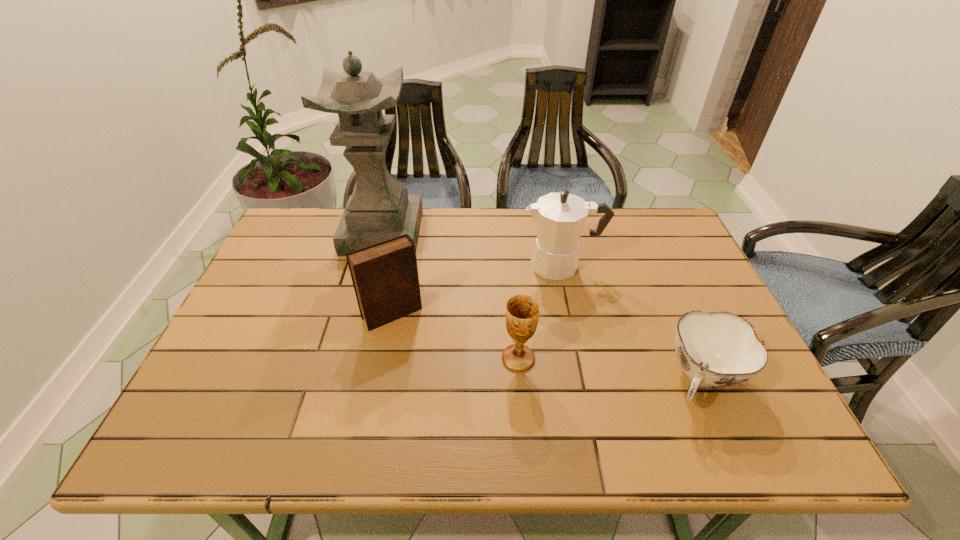
Where is `vacant area at the left edge of the desktop`? This screenshot has height=540, width=960. vacant area at the left edge of the desktop is located at coordinates point(281,340).

Where is `vacant region at the right edge of the desktop`? vacant region at the right edge of the desktop is located at coordinates click(x=660, y=289).

Image resolution: width=960 pixels, height=540 pixels. I want to click on vacant area at the far left corner of the desktop, so click(x=333, y=213).

The image size is (960, 540). Find the location of `vacant space that is in between the rightmost object and the sculpture`. vacant space that is in between the rightmost object and the sculpture is located at coordinates (542, 306).

Identify the location of unoccupied position between the tallest object and the rightmost object. (542, 306).

The width and height of the screenshot is (960, 540). I want to click on free space between the rightmost object and the sculpture, so click(542, 306).

The image size is (960, 540). What are the coordinates of `vacant space that is in between the coffeepot and the third farthest object` in the screenshot? It's located at (477, 289).

The width and height of the screenshot is (960, 540). Find the location of `empty space that is in between the coffeepot and the Bible`. empty space that is in between the coffeepot and the Bible is located at coordinates (477, 289).

Find the location of a particular element. unoccupied area between the coffeepot and the third nearest object is located at coordinates (477, 289).

At what (x,y) coordinates should I click in order to perform the action: click on free space between the tallest object and the chalice. Please return your answer as a coordinate pair (x, y). This screenshot has width=960, height=540. Looking at the image, I should click on (450, 295).